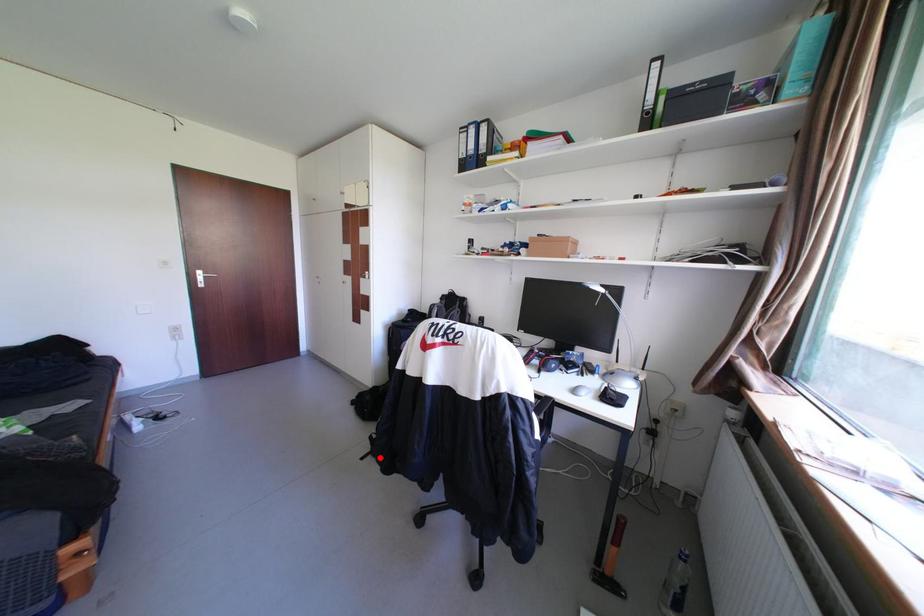
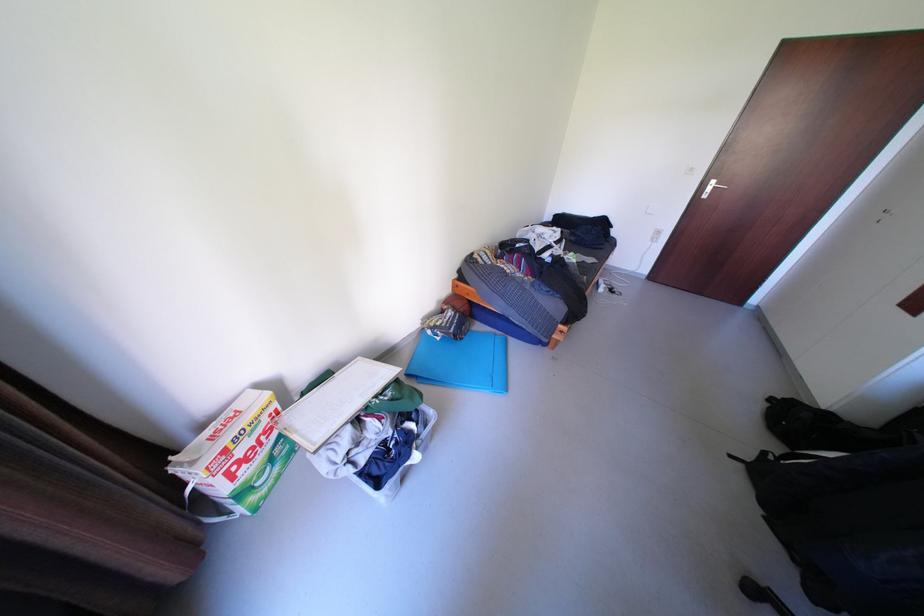
Find the pixel in the second image that matches the highlighted location in the first image.

(752, 466)